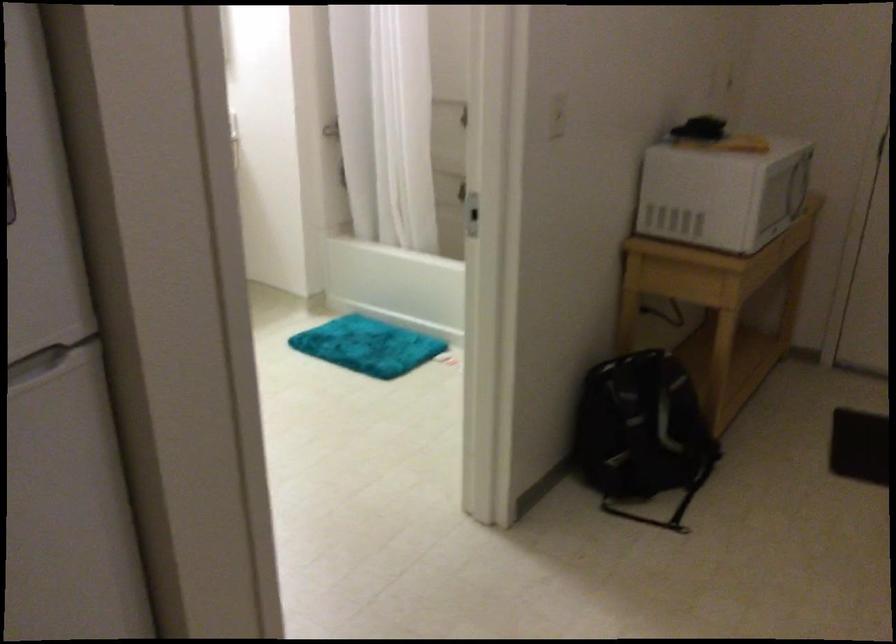
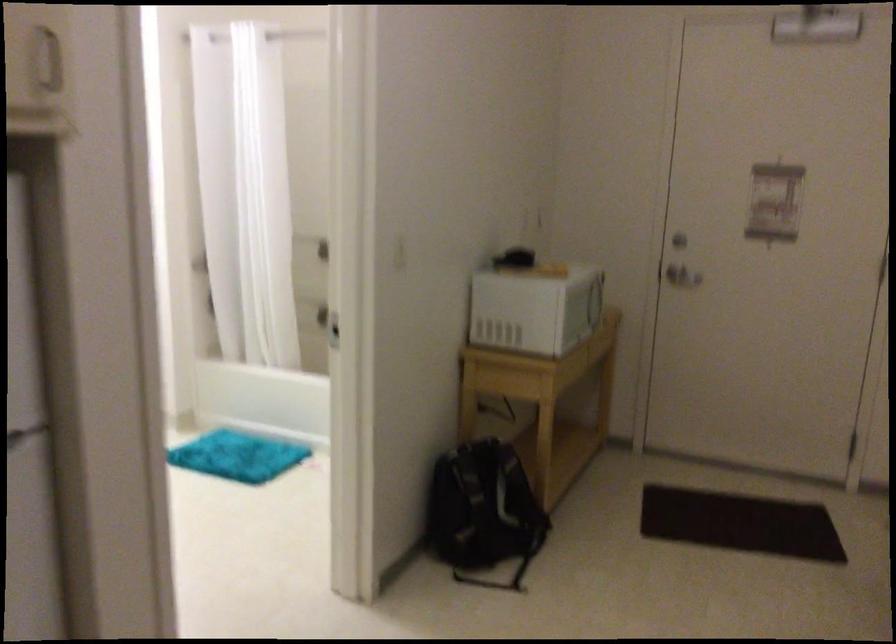
Question: Based on the continuous images, in which direction is the camera rotating? Reply with the corresponding letter.

Choices:
 (A) Left
 (B) Right
 (C) Up
 (D) Down

Answer: (B)